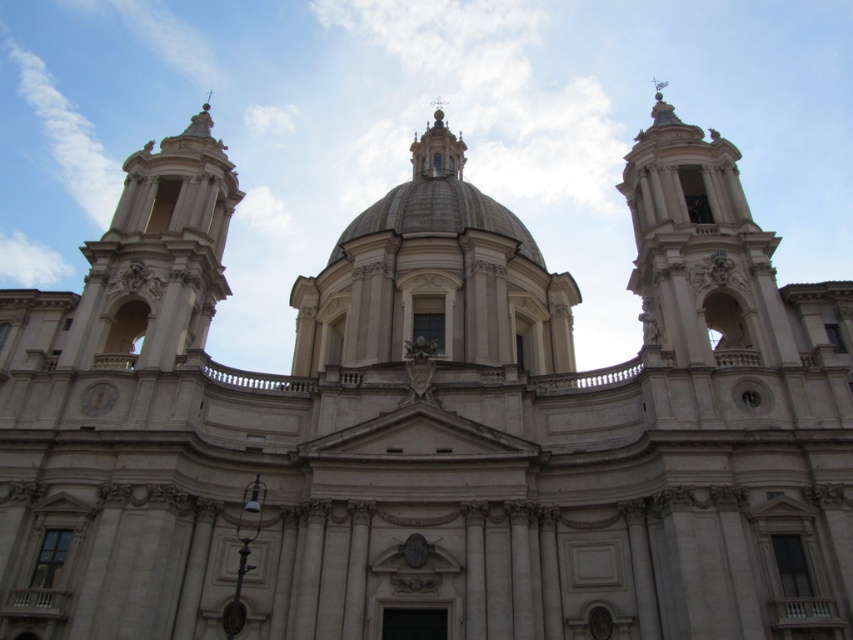
Question: Among these objects, which one is farthest from the camera?

Choices:
 (A) white stone tower at left
 (B) white marble clock at lower left
 (C) white marble dome at center

Answer: (C)

Question: Where is white stone tower at left located in relation to white marble clock at lower left in the image?

Choices:
 (A) below
 (B) above

Answer: (B)

Question: Is white marble dome at center to the right of white marble clock at lower left from the viewer's perspective?

Choices:
 (A) yes
 (B) no

Answer: (A)

Question: Which point appears closest to the camera in this image?

Choices:
 (A) (142, 323)
 (B) (82, 394)

Answer: (B)

Question: Is white marble dome at center thinner than white marble clock at lower left?

Choices:
 (A) no
 (B) yes

Answer: (A)

Question: Which point is farther to the camera?

Choices:
 (A) white marble clock at lower left
 (B) white marble dome at center
 (C) white stone tower at left

Answer: (B)